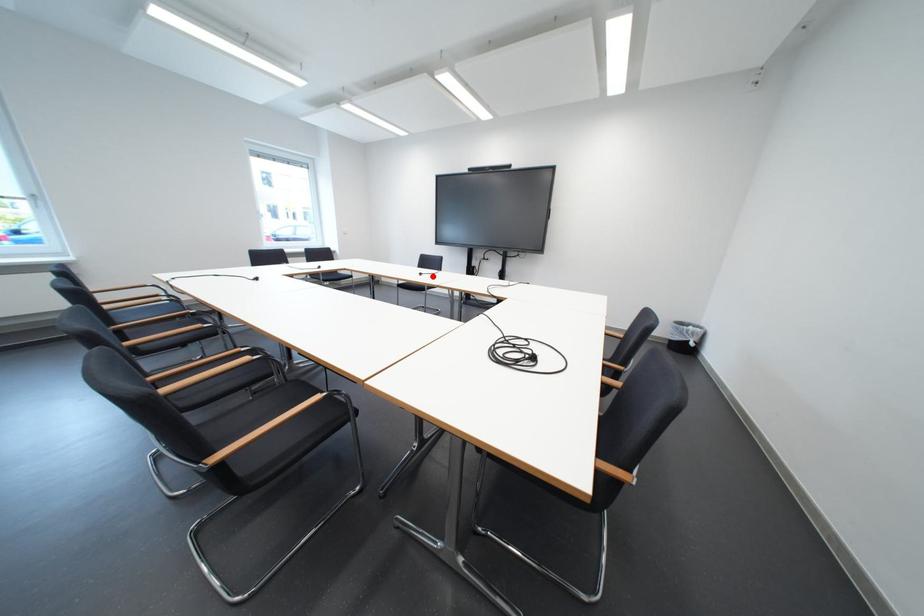
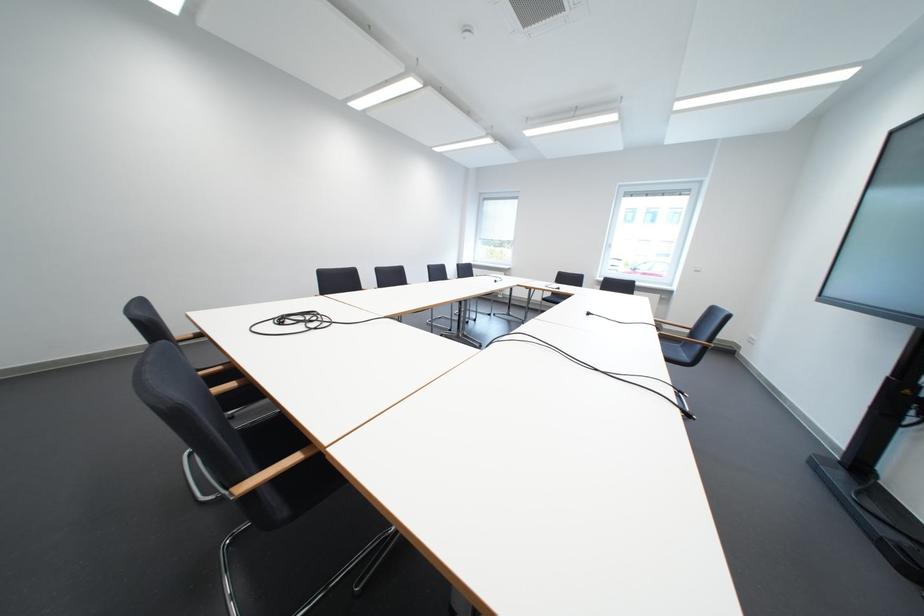
Question: I am providing you with two images of the same scene from different viewpoints. Image1 has a red point marked. In image2, the corresponding 3D location appears at what relative position? Reply with the corresponding letter.

Choices:
 (A) Closer
 (B) Farther

Answer: (A)